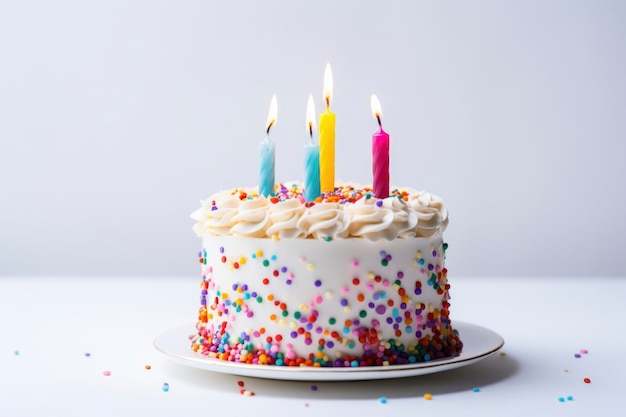
I want to click on candle flames, so click(x=274, y=110), click(x=309, y=106), click(x=329, y=85), click(x=375, y=105).